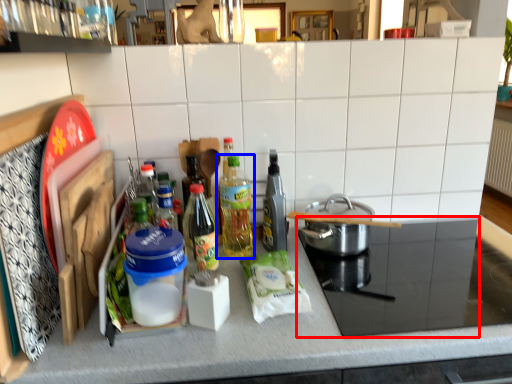
Question: Which point is further to the camera, appliance (highlighted by a red box) or bottle (highlighted by a blue box)?

Choices:
 (A) appliance
 (B) bottle

Answer: (B)